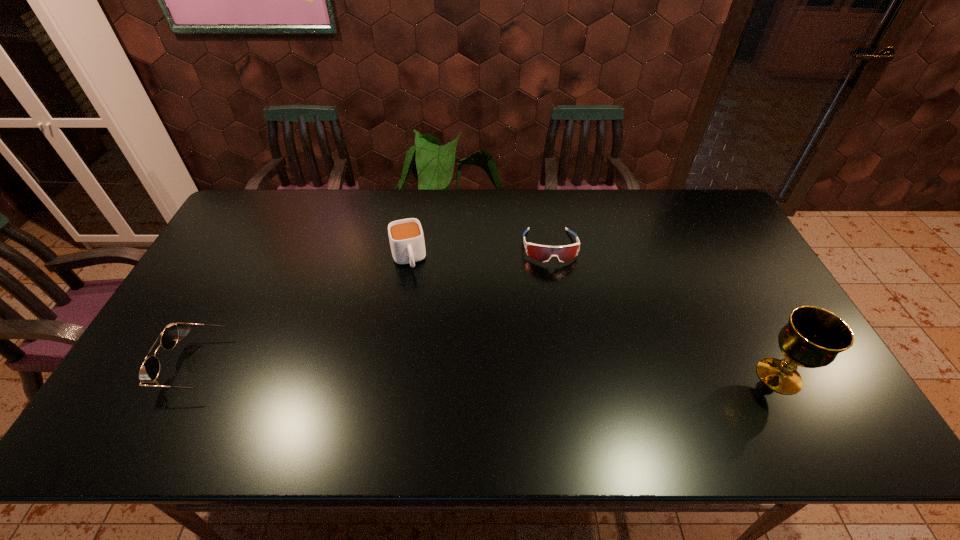
The image size is (960, 540). I want to click on vacant space on the desktop that is between the leftmost object and the rightmost object and is positioned on the side with the handle of the cup, so click(437, 370).

In order to click on vacant space on the desktop that is between the sunglasses and the rightmost object and is positioned on the front-facing side of the second object from right to left in this screenshot , I will do (569, 373).